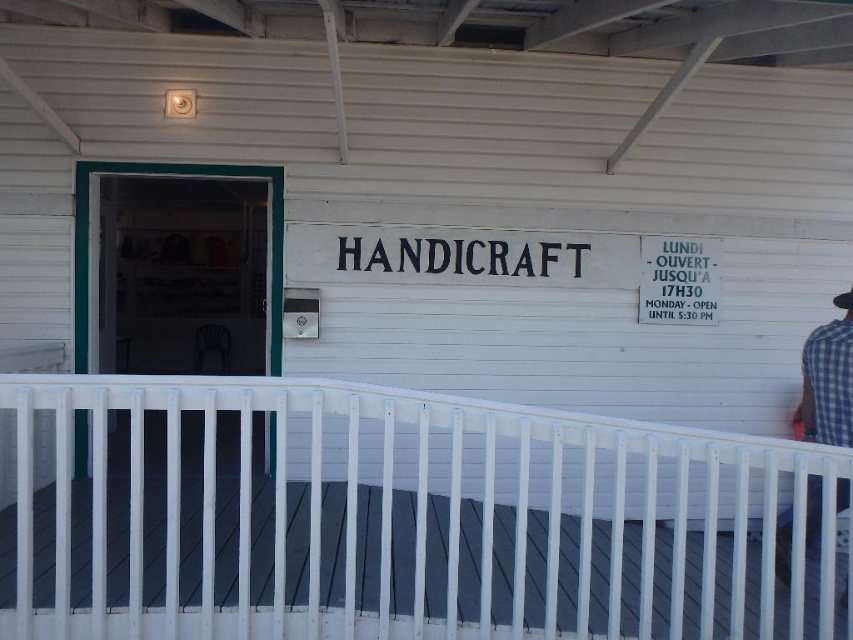
You are a customer arriving at the HANDICRAFT store. You see a white painted wood porch at lower center and a blue checkered shirt at right. Which object is larger in size?

The white painted wood porch at lower center is bigger than the blue checkered shirt at right.

You are a delivery person trying to park your van in front of the HANDICRAFT store. The van is 2 meters wide. The white painted wood porch at lower center and the blue checkered shirt at right are in your way. Based on their widths, can the van fit between them?

The white painted wood porch at lower center is wider than the blue checkered shirt at right. Since the van is 2 meters wide, it depends on the total available space between them. However, the description only states the porch is wider, not the exact dimensions. Without specific measurements, we cannot confirm if the van will fit.